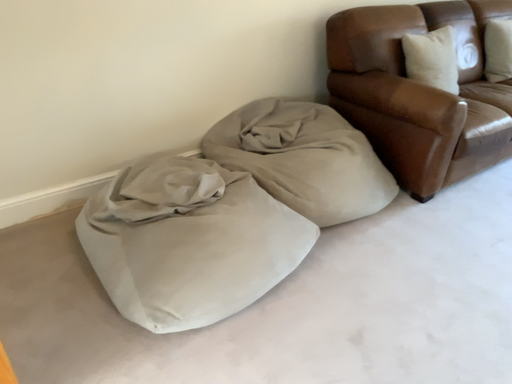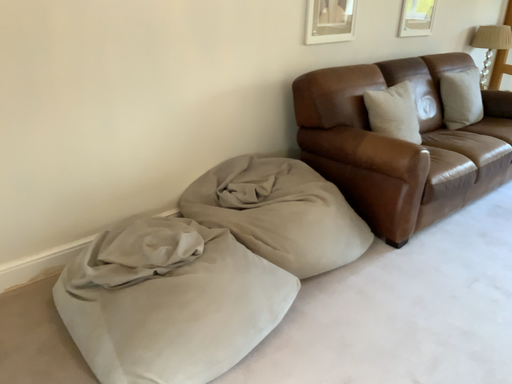
Question: Which way did the camera rotate in the video?

Choices:
 (A) rotated downward
 (B) rotated upward

Answer: (B)